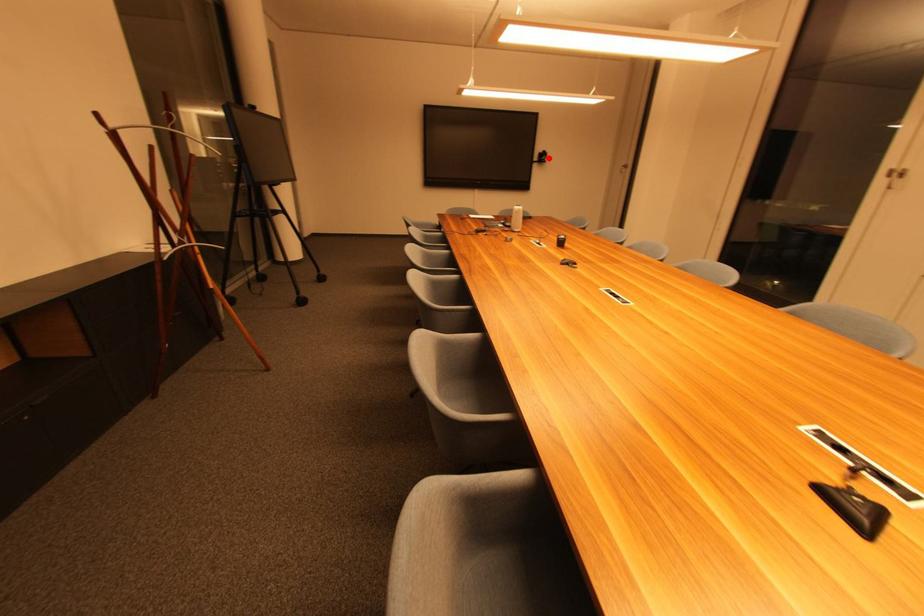
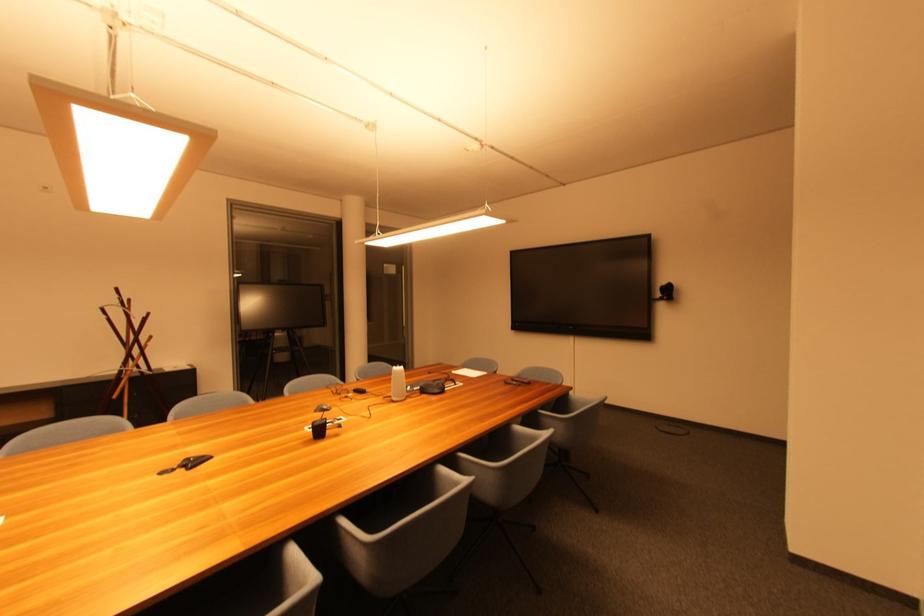
Question: I am providing you with two images of the same scene from different viewpoints. A red point is shown in image1. For the corresponding object point in image2, is it positioned nearer or farther from the camera?

Choices:
 (A) Nearer
 (B) Farther

Answer: (B)